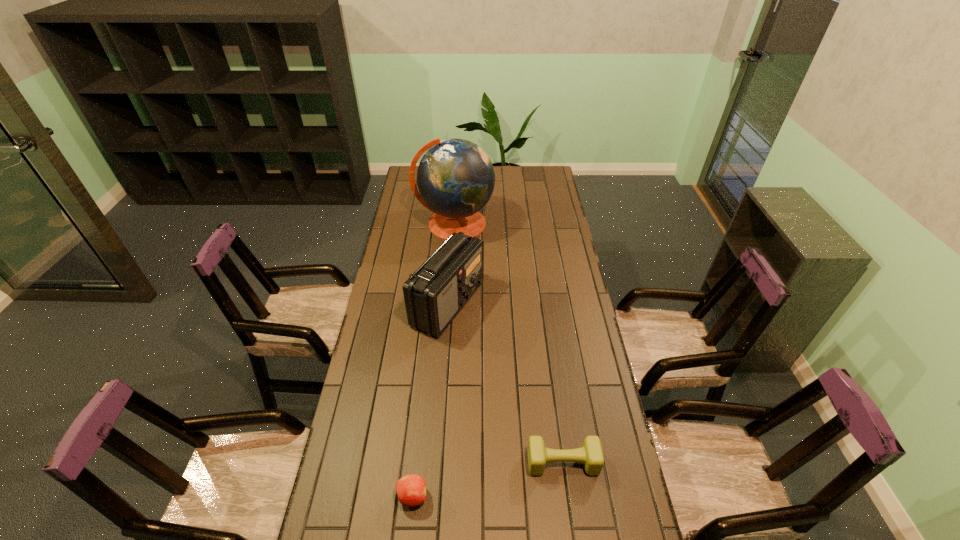
This screenshot has height=540, width=960. What are the coordinates of `free space located on the back of the nearest object` in the screenshot? It's located at (421, 413).

Find the location of a particular element. globe that is at the left edge is located at coordinates (455, 178).

You are a GUI agent. You are given a task and a screenshot of the screen. Output one action in this format:
    pyautogui.click(x=<x>, y=<y>)
    Task: Click on the radio receiver located in the left edge section of the desktop
    
    Given the screenshot: What is the action you would take?
    pyautogui.click(x=434, y=294)

You are a GUI agent. You are given a task and a screenshot of the screen. Output one action in this format:
    pyautogui.click(x=<x>, y=<y>)
    Task: Click on the object at the right edge
    
    Given the screenshot: What is the action you would take?
    pyautogui.click(x=590, y=454)

In the image, there is a desktop. Find the location of `blank space at the left edge`. blank space at the left edge is located at coordinates (413, 261).

In the image, there is a desktop. Where is `blank space at the right edge`? The image size is (960, 540). blank space at the right edge is located at coordinates (537, 250).

The image size is (960, 540). Identify the location of vacant point located between the apple and the third farthest object. (488, 480).

This screenshot has height=540, width=960. I want to click on free space between the second nearest object and the tallest object, so click(x=509, y=343).

I want to click on vacant point located between the dumbbell and the second tallest object, so click(505, 383).

The image size is (960, 540). What are the coordinates of `free point between the globe and the dumbbell` in the screenshot? It's located at (509, 343).